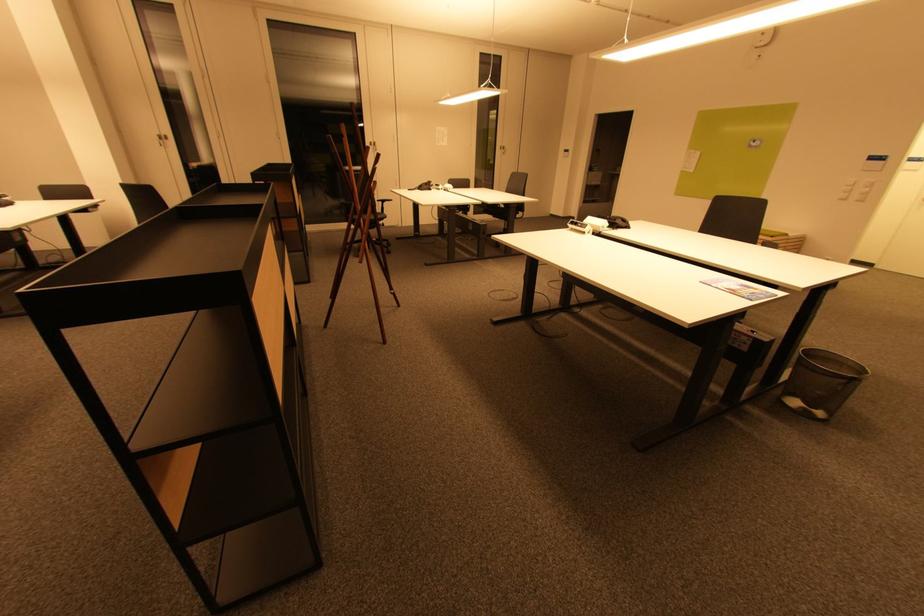
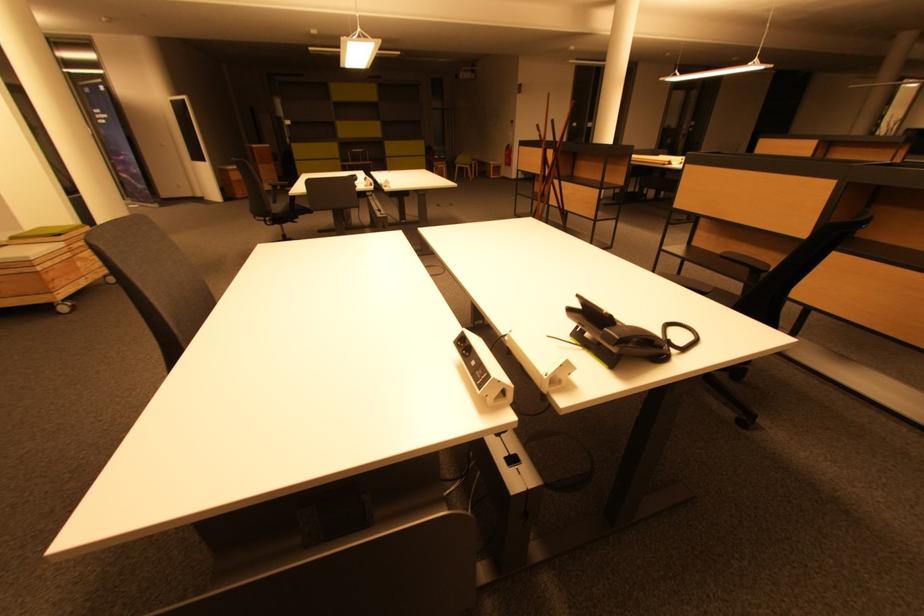
Question: I am providing you with two images of the same scene from different viewpoints. Which of the following objects are not visible in image2?

Choices:
 (A) chair sitting surface
 (B) green plastic box
 (C) wooden storage box
 (D) black telephone handset

Answer: (A)